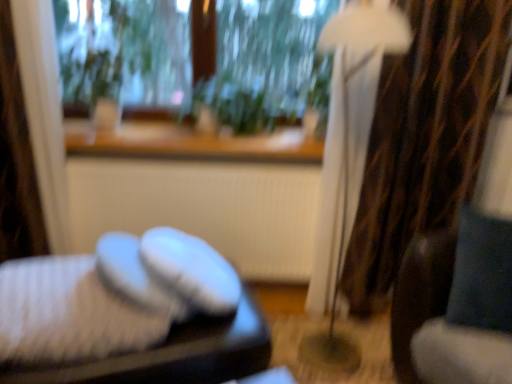
Question: Is white matte radiator at center at the left side of velvet blue swivel chair at right?

Choices:
 (A) no
 (B) yes

Answer: (B)

Question: Considering the relative sizes of white matte radiator at center and velvet blue swivel chair at right in the image provided, is white matte radiator at center bigger than velvet blue swivel chair at right?

Choices:
 (A) yes
 (B) no

Answer: (A)

Question: Does white matte radiator at center turn towards velvet blue swivel chair at right?

Choices:
 (A) yes
 (B) no

Answer: (B)

Question: Can you confirm if white matte radiator at center is shorter than velvet blue swivel chair at right?

Choices:
 (A) no
 (B) yes

Answer: (A)

Question: Does white matte radiator at center have a lesser width compared to velvet blue swivel chair at right?

Choices:
 (A) no
 (B) yes

Answer: (B)

Question: Considering the positions of white fabric lampshade at right and white matte radiator at center in the image, is white fabric lampshade at right bigger or smaller than white matte radiator at center?

Choices:
 (A) big
 (B) small

Answer: (A)

Question: From a real-world perspective, is white fabric lampshade at right above or below white matte radiator at center?

Choices:
 (A) above
 (B) below

Answer: (A)

Question: From the image's perspective, is white fabric lampshade at right above or below white matte radiator at center?

Choices:
 (A) below
 (B) above

Answer: (B)

Question: Relative to white matte radiator at center, is white fabric lampshade at right in front or behind?

Choices:
 (A) front
 (B) behind

Answer: (A)

Question: Considering the positions of point (245, 357) and point (88, 352), is point (245, 357) closer or farther from the camera than point (88, 352)?

Choices:
 (A) closer
 (B) farther

Answer: (B)

Question: Is white knitted slippers at lower left wider or thinner than white knitted socks at lower left?

Choices:
 (A) thin
 (B) wide

Answer: (B)

Question: Considering the positions of white knitted slippers at lower left and white knitted socks at lower left in the image, is white knitted slippers at lower left taller or shorter than white knitted socks at lower left?

Choices:
 (A) short
 (B) tall

Answer: (B)

Question: Would you say white knitted slippers at lower left is to the left or to the right of white knitted socks at lower left in the picture?

Choices:
 (A) left
 (B) right

Answer: (B)

Question: Is point (504, 238) positioned closer to the camera than point (47, 286)?

Choices:
 (A) closer
 (B) farther

Answer: (B)

Question: Would you say velvet blue swivel chair at right is to the left or to the right of white knitted socks at lower left in the picture?

Choices:
 (A) left
 (B) right

Answer: (B)